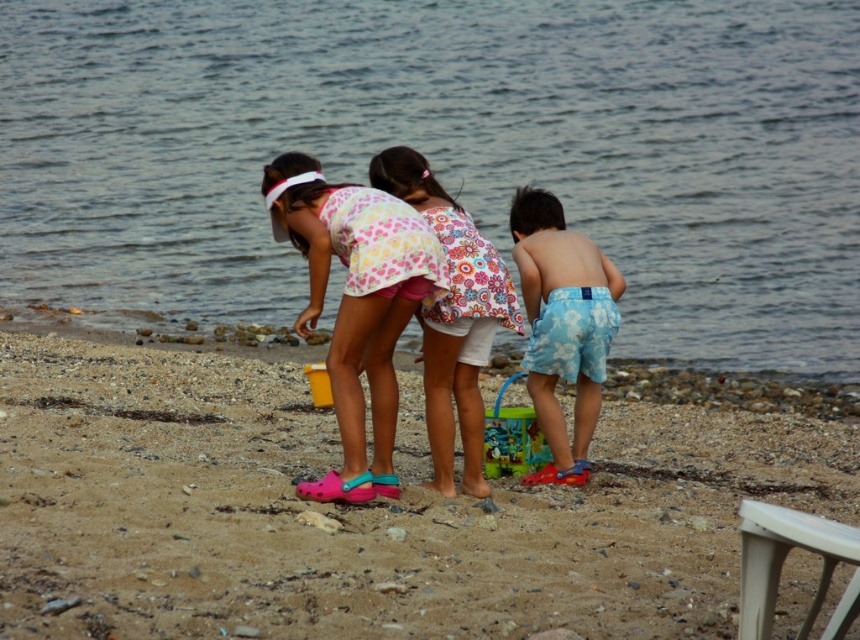
Which is in front, point (11, 333) or point (557, 304)?

Point (557, 304) is in front.

Image resolution: width=860 pixels, height=640 pixels. I want to click on brown sandy beach at center, so click(x=360, y=512).

Measure the distance between point (373,518) and camera.

They are 9.81 meters apart.

What are the coordinates of `brown sandy beach at center` in the screenshot? It's located at (360, 512).

Measure the distance between point (453, 346) and camera.

A distance of 11.31 meters exists between point (453, 346) and camera.

Is floral fabric dress at center thinner than multicolored plastic bucket at center?

No.

Identify the location of floral fabric dress at center. (452, 317).

Does pink crocs at center appear under white plastic stool at lower right?

No, pink crocs at center is not below white plastic stool at lower right.

Identify the location of pink crocs at center. The width and height of the screenshot is (860, 640). (355, 304).

You are a GUI agent. You are given a task and a screenshot of the screen. Output one action in this format:
    pyautogui.click(x=<x>, y=<y>)
    Task: Click on the pink crocs at center
    This screenshot has width=860, height=640.
    Given the screenshot: What is the action you would take?
    pyautogui.click(x=355, y=304)